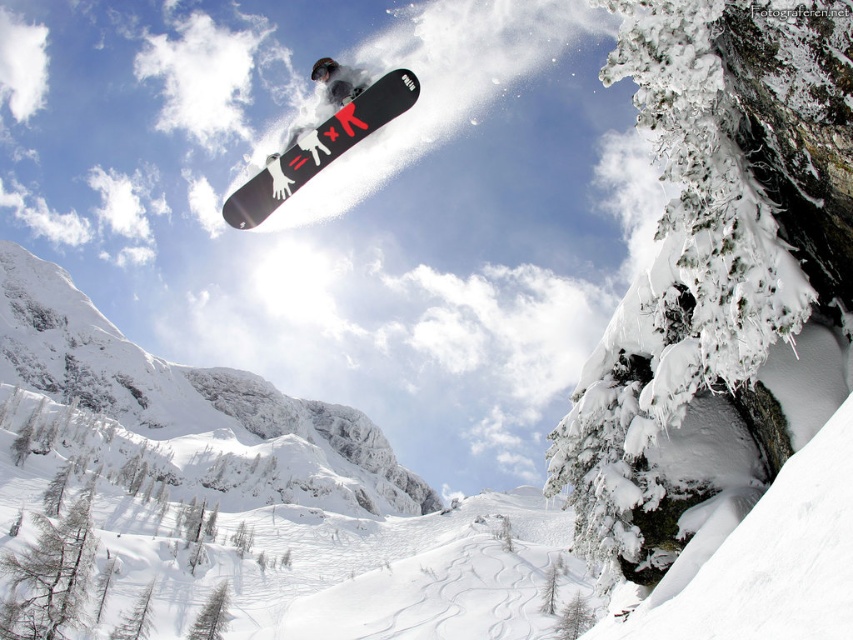
Question: Which of the following is the farthest from the observer?

Choices:
 (A) black matte snowboard at center
 (B) black matte snowboarder at center

Answer: (B)

Question: Which point is closer to the camera?

Choices:
 (A) (251, 225)
 (B) (316, 76)

Answer: (A)

Question: Does black matte snowboard at center appear on the right side of black matte snowboarder at center?

Choices:
 (A) no
 (B) yes

Answer: (B)

Question: Does black matte snowboard at center appear over black matte snowboarder at center?

Choices:
 (A) yes
 (B) no

Answer: (B)

Question: Considering the relative positions of black matte snowboard at center and black matte snowboarder at center in the image provided, where is black matte snowboard at center located with respect to black matte snowboarder at center?

Choices:
 (A) right
 (B) left

Answer: (A)